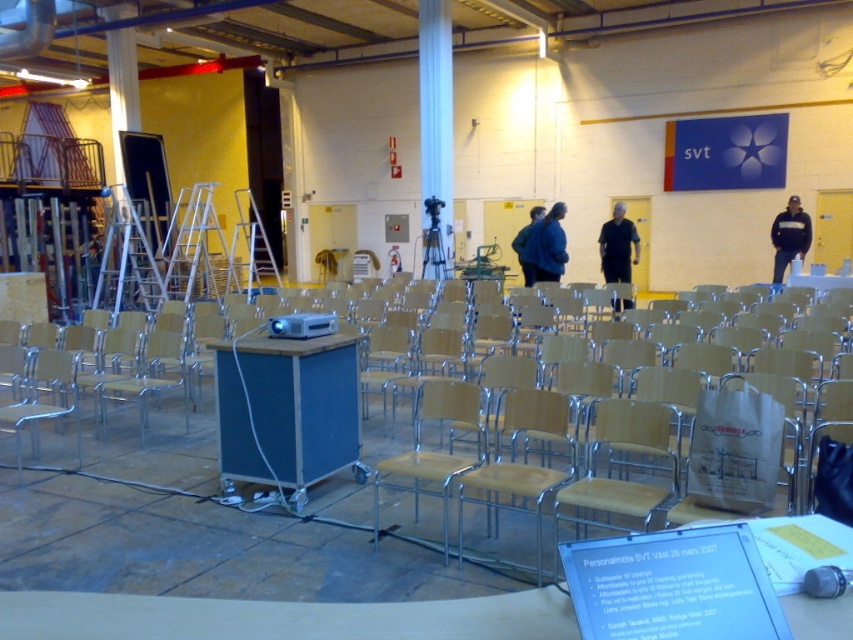
You are an event organizer setting up for a presentation. You have a blue wood table at center and a blue fabric jacket at center. Where should you place the projector remote so it is easily accessible from both objects?

Place the projector remote between the blue wood table at center and the blue fabric jacket at center since the blue wood table at center is to the left of blue fabric jacket at center, making the midpoint between them the most accessible location.

You are standing in the center of the room and want to place a new object at the point labeled point (x=287, y=412). According to the scene description, where exactly is this point located?

The point (x=287, y=412) is on the blue wood table at center.